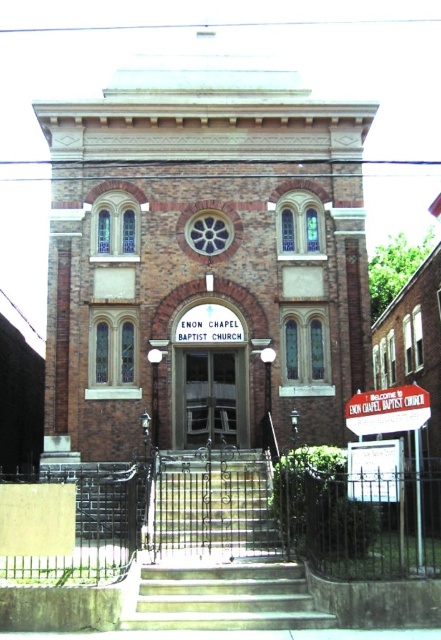
Which is above, metallic stair at center or white paper sign at center?

Positioned higher is white paper sign at center.

Does point (221, 504) come farther from viewer compared to point (365, 454)?

Yes.

Locate an element on the screen. The width and height of the screenshot is (441, 640). metallic stair at center is located at coordinates (210, 506).

Find the location of a particular element. metallic stair at center is located at coordinates (210, 506).

Looking at this image, does wooden door at center have a greater height compared to white paper sign at center?

Yes, wooden door at center is taller than white paper sign at center.

Between wooden door at center and white paper sign at center, which one has more height?

wooden door at center

Is point (235, 392) behind point (380, 442)?

Yes, point (235, 392) is behind point (380, 442).

Where is `wooden door at center`? wooden door at center is located at coordinates (209, 397).

Which is behind, point (171, 310) or point (194, 600)?

Point (171, 310)

Is brown brick chapel at center positioned at the back of concrete stairs at center?

Yes.

I want to click on brown brick chapel at center, so click(x=202, y=252).